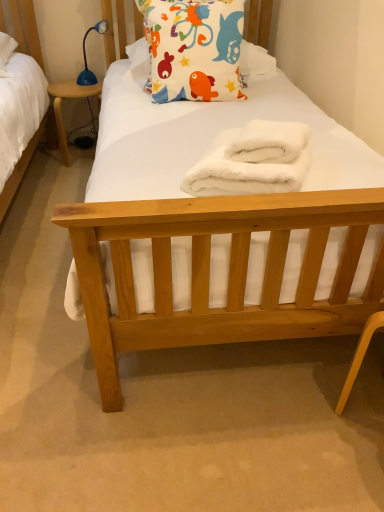
Question: From the image's perspective, is white fluffy towel at center located beneath blue plastic desk at left?

Choices:
 (A) no
 (B) yes

Answer: (B)

Question: Considering the relative sizes of white fluffy towel at center and blue plastic desk at left in the image provided, is white fluffy towel at center wider than blue plastic desk at left?

Choices:
 (A) no
 (B) yes

Answer: (A)

Question: Can we say white fluffy towel at center lies outside blue plastic desk at left?

Choices:
 (A) no
 (B) yes

Answer: (B)

Question: Is white fluffy towel at center positioned with its back to blue plastic desk at left?

Choices:
 (A) yes
 (B) no

Answer: (B)

Question: Does white fluffy towel at center have a greater height compared to blue plastic desk at left?

Choices:
 (A) no
 (B) yes

Answer: (A)

Question: Considering the positions of white fluffy bath towel at center and blue plastic desk at left in the image, is white fluffy bath towel at center taller or shorter than blue plastic desk at left?

Choices:
 (A) tall
 (B) short

Answer: (B)

Question: Is point (254, 138) positioned closer to the camera than point (97, 86)?

Choices:
 (A) farther
 (B) closer

Answer: (B)

Question: Is white fluffy bath towel at center spatially inside blue plastic desk at left, or outside of it?

Choices:
 (A) inside
 (B) outside

Answer: (B)

Question: Is white fluffy bath towel at center bigger or smaller than blue plastic desk at left?

Choices:
 (A) small
 (B) big

Answer: (A)

Question: Considering their positions, is white fabric pillow with colorful fish designs at upper center located in front of or behind blue plastic desk at left?

Choices:
 (A) front
 (B) behind

Answer: (A)

Question: In terms of size, does white fabric pillow with colorful fish designs at upper center appear bigger or smaller than blue plastic desk at left?

Choices:
 (A) big
 (B) small

Answer: (A)

Question: Does point (148, 40) appear closer or farther from the camera than point (61, 123)?

Choices:
 (A) closer
 (B) farther

Answer: (A)

Question: From a real-world perspective, is white fabric pillow with colorful fish designs at upper center physically located above or below blue plastic desk at left?

Choices:
 (A) below
 (B) above

Answer: (B)

Question: Would you say white fluffy bath towel at center is to the left or to the right of blue plastic lamp at upper left in the picture?

Choices:
 (A) left
 (B) right

Answer: (B)

Question: Does point (291, 159) appear closer or farther from the camera than point (94, 27)?

Choices:
 (A) farther
 (B) closer

Answer: (B)